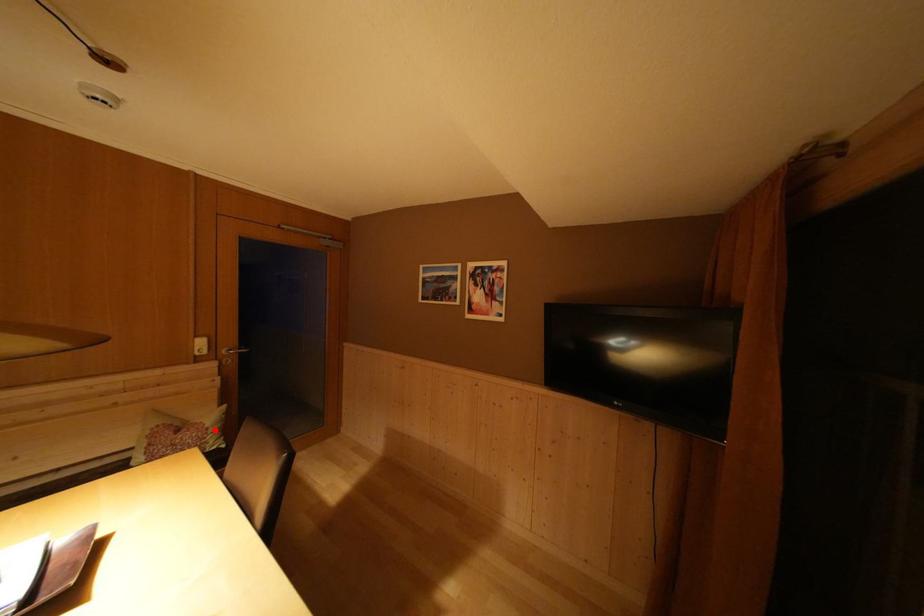
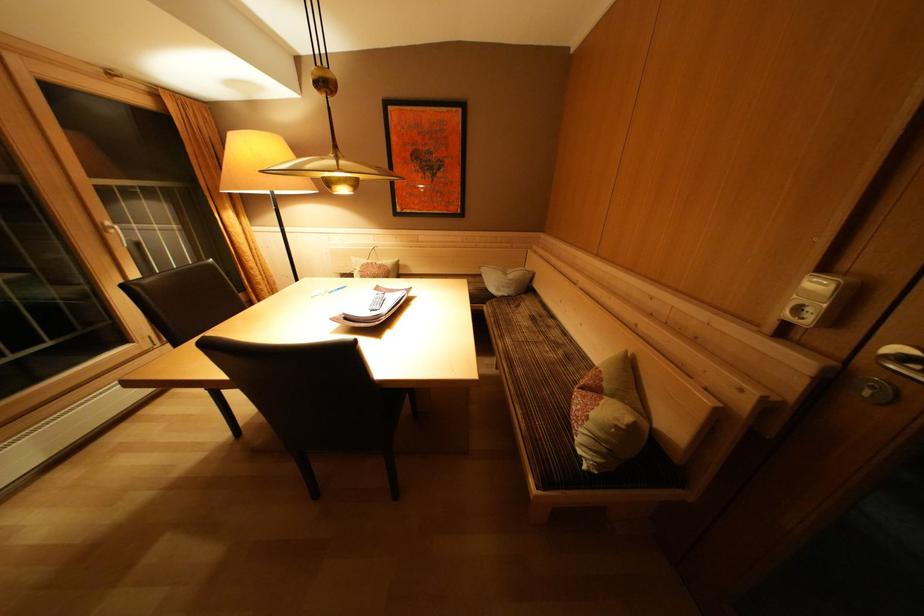
Where in the second image is the point corresponding to the highlighted location from the first image?

(600, 419)